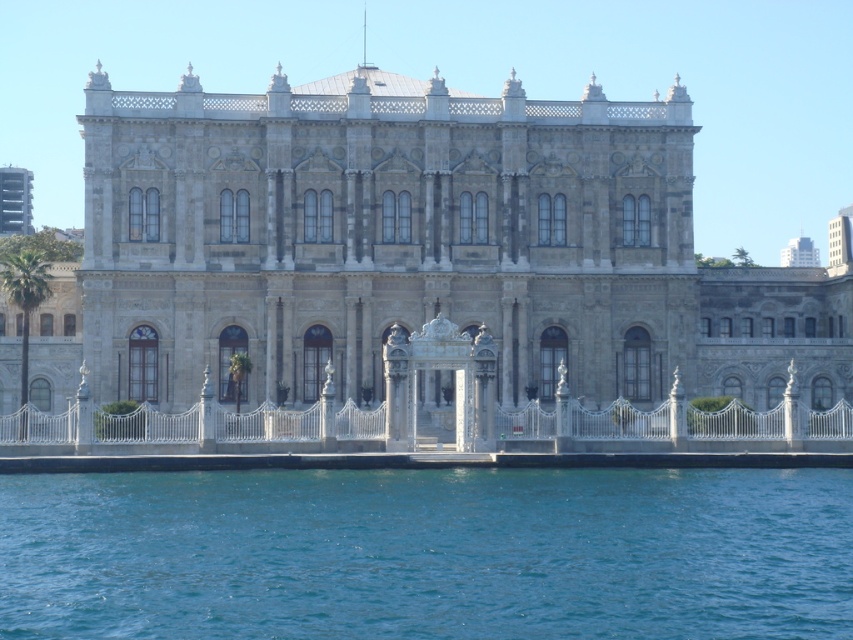
Question: Does stone building at center appear on the left side of blue liquid water at lower center?

Choices:
 (A) yes
 (B) no

Answer: (B)

Question: Which point is farther to the camera?

Choices:
 (A) (534, 202)
 (B) (750, 570)

Answer: (A)

Question: Which point is farther to the camera?

Choices:
 (A) (830, 385)
 (B) (451, 534)

Answer: (A)

Question: Considering the relative positions of stone building at center and blue liquid water at lower center in the image provided, where is stone building at center located with respect to blue liquid water at lower center?

Choices:
 (A) right
 (B) left

Answer: (A)

Question: Is stone building at center further to camera compared to blue liquid water at lower center?

Choices:
 (A) yes
 (B) no

Answer: (A)